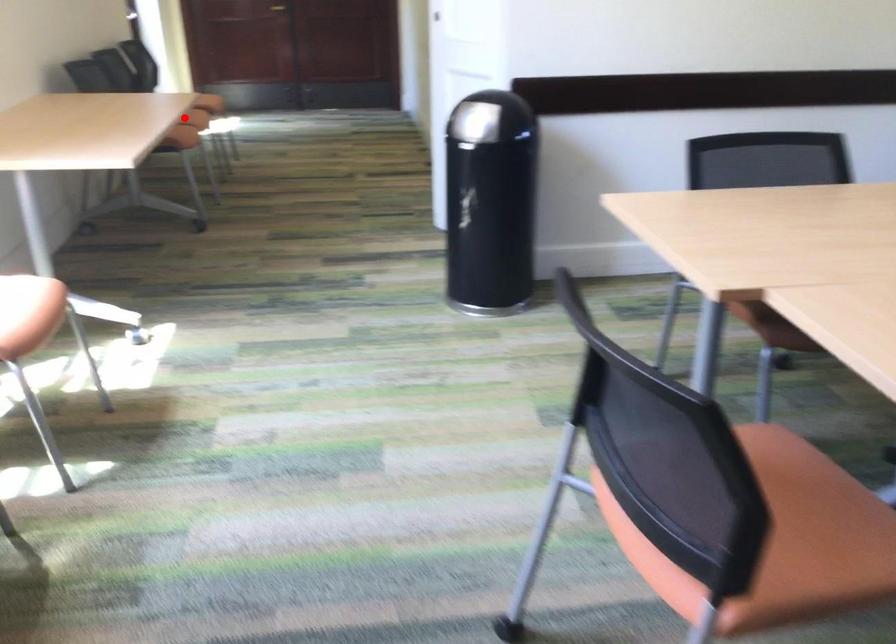
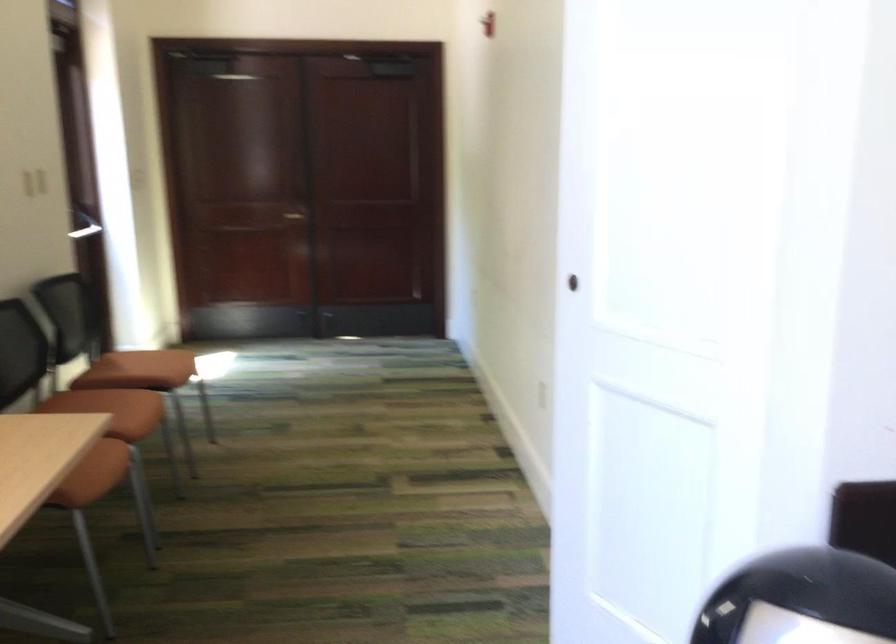
The point at the highlighted location is marked in the first image. Where is the corresponding point in the second image?

(106, 460)